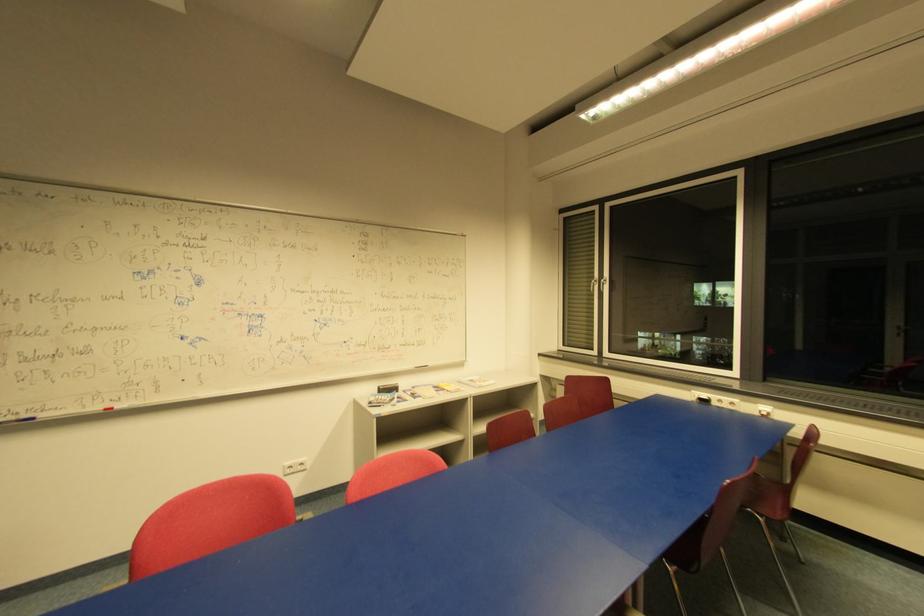
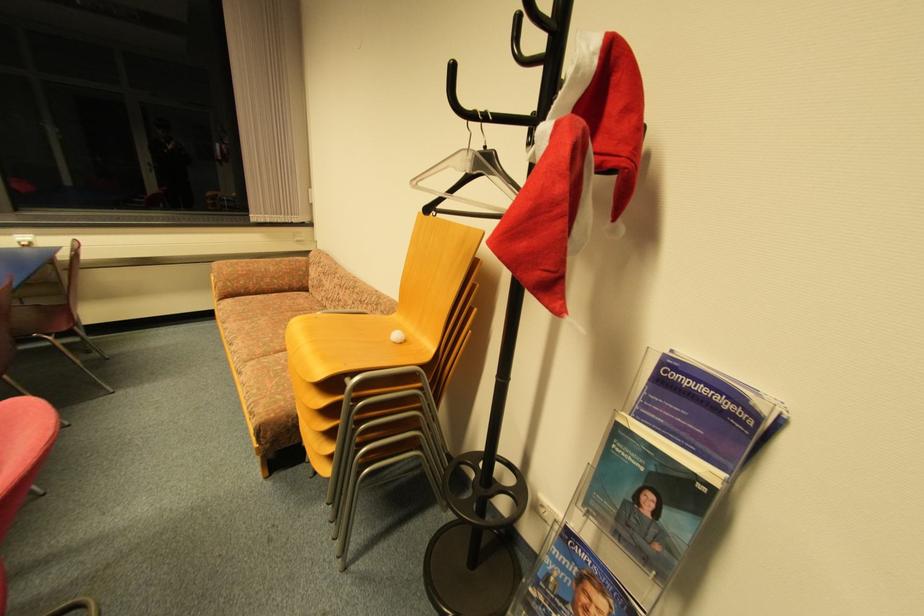
First-person continuous shooting, in which direction is the camera rotating?

The camera's rotation is toward right-down.